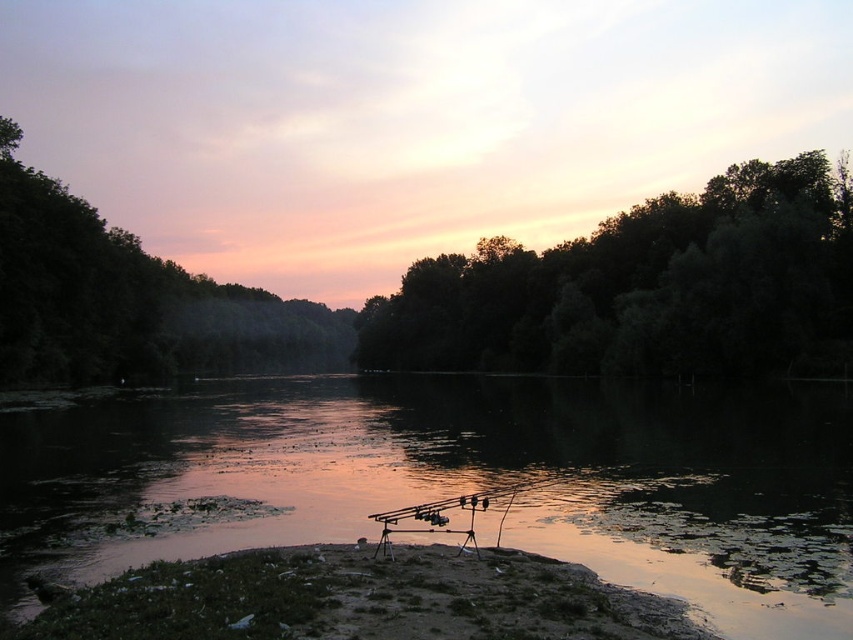
Describe the element at coordinates (468, 477) in the screenshot. I see `translucent water at center` at that location.

Between point (157, 420) and point (300, 630), which one is positioned in front?

Positioned in front is point (300, 630).

Measure the distance between translucent water at center and camera.

The distance of translucent water at center from camera is 8.54 meters.

This screenshot has height=640, width=853. What are the coordinates of `translucent water at center` in the screenshot? It's located at (468, 477).

Is dark green leafy trees at upper center positioned at the back of dark green leafy trees at upper left?

That is True.

Can you confirm if dark green leafy trees at upper center is positioned below dark green leafy trees at upper left?

Indeed, dark green leafy trees at upper center is positioned under dark green leafy trees at upper left.

In order to click on dark green leafy trees at upper center in this screenshot , I will do `click(645, 289)`.

Is brown dirt at lower center positioned behind dark green leafy trees at upper left?

No.

Is point (318, 632) closer to viewer compared to point (248, 323)?

That is True.

This screenshot has height=640, width=853. What are the coordinates of `brown dirt at lower center` in the screenshot? It's located at (358, 598).